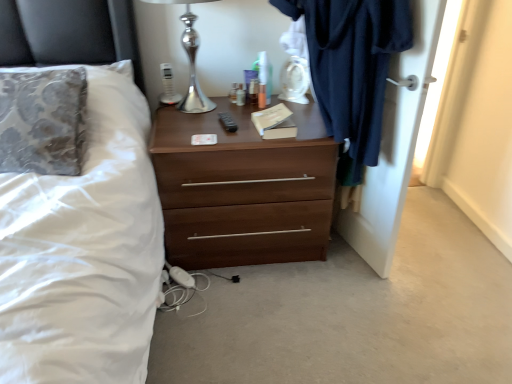
Find the location of a particular element. The width and height of the screenshot is (512, 384). vacant space underneath silver metallic table lamp at upper center (from a real-world perspective) is located at coordinates tap(202, 111).